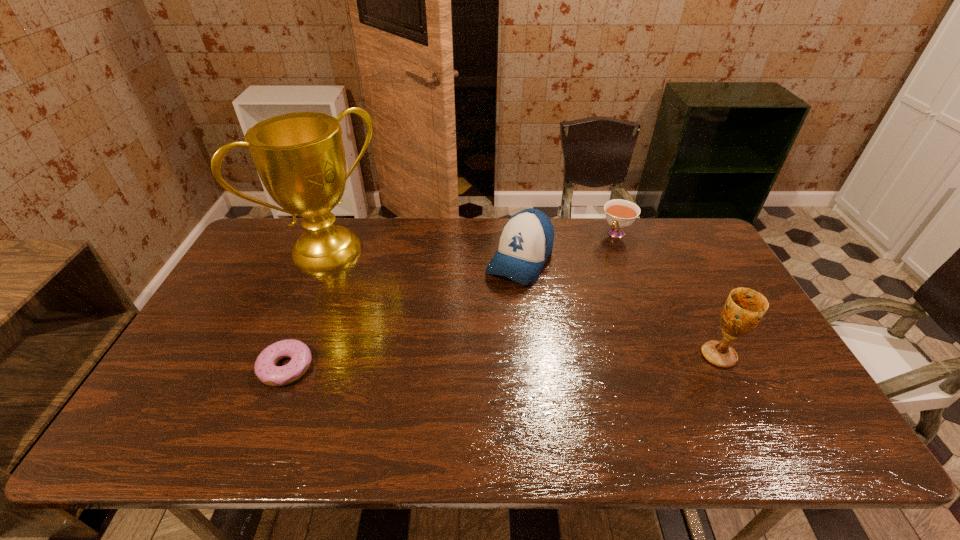
Identify the location of free spot between the award and the second object from right to left. (472, 241).

You are a GUI agent. You are given a task and a screenshot of the screen. Output one action in this format:
    pyautogui.click(x=<x>, y=<y>)
    Task: Click on the free space that is in between the rightmost object and the tallest object
    
    Given the screenshot: What is the action you would take?
    pyautogui.click(x=524, y=302)

At what (x,y) coordinates should I click in order to perform the action: click on vacant space that is in between the third tallest object and the shortest object. Please return your answer as a coordinate pair (x, y). Looking at the image, I should click on (403, 313).

This screenshot has height=540, width=960. Find the location of `empty space between the teacup and the tallest object`. empty space between the teacup and the tallest object is located at coordinates coord(472,241).

What are the coordinates of `free space between the award and the shortest object` in the screenshot? It's located at (307, 308).

I want to click on vacant space in between the teacup and the tallest object, so click(x=472, y=241).

This screenshot has height=540, width=960. I want to click on vacant area between the shortest object and the baseball cap, so click(403, 313).

At what (x,y) coordinates should I click in order to perform the action: click on vacant point located between the second shortest object and the doughnut. Please return your answer as a coordinate pair (x, y). Looking at the image, I should click on (451, 300).

The height and width of the screenshot is (540, 960). Identify the location of vacant region between the award and the doughnut. (307, 308).

Find the location of `free point between the tallest object and the second tallest object`. free point between the tallest object and the second tallest object is located at coordinates (524, 302).